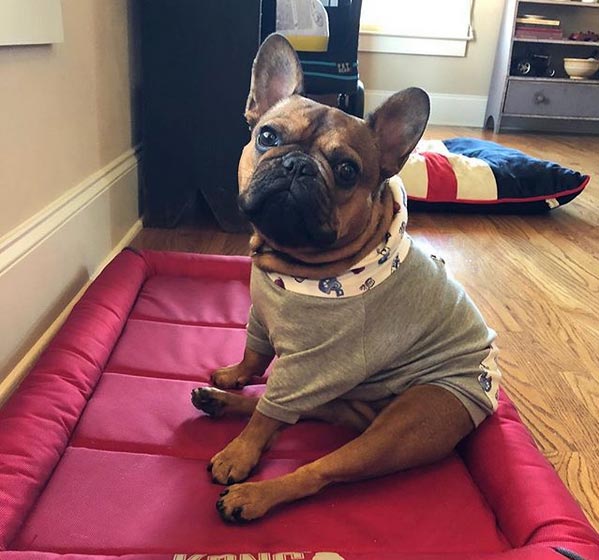
At what (x,y) coordinates should I click in order to perform the action: click on red cushioned dog bed. Please return your answer as a coordinate pair (x, y). Image resolution: width=599 pixels, height=560 pixels. Looking at the image, I should click on (87, 470).